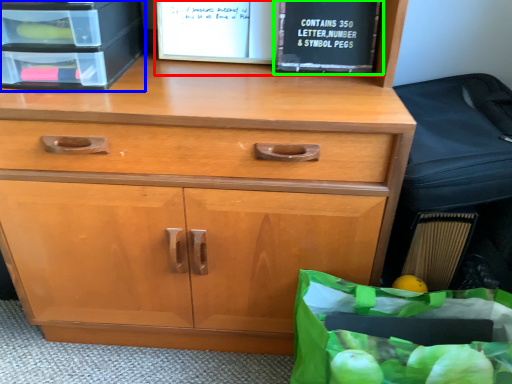
Question: Based on their relative distances, which object is nearer to book (highlighted by a red box)? Choose from crate (highlighted by a blue box) and paperback book (highlighted by a green box).

Choices:
 (A) crate
 (B) paperback book

Answer: (B)